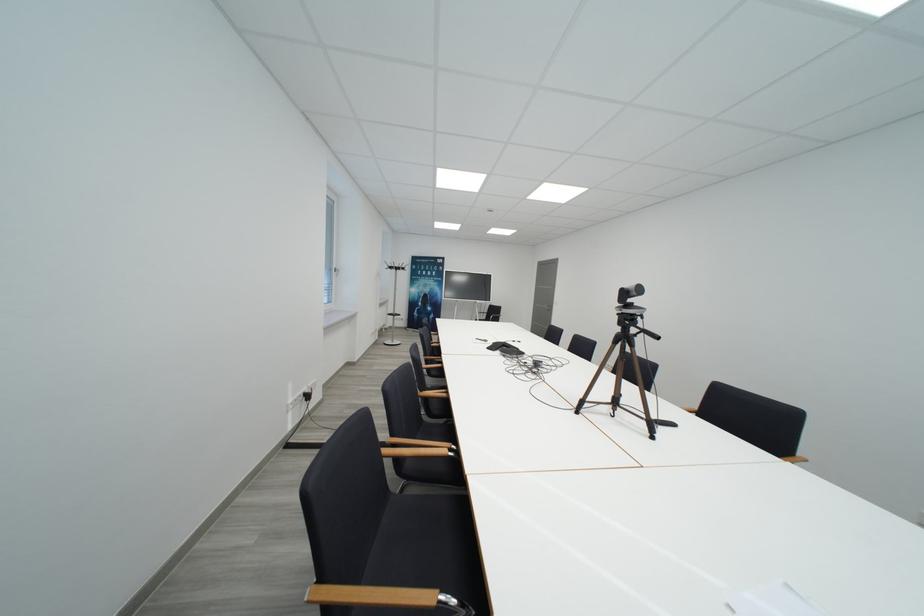
Find where to resting arm the wooden chair armrest. Please return your answer as a coordinate pair (x, y).

(385, 598)